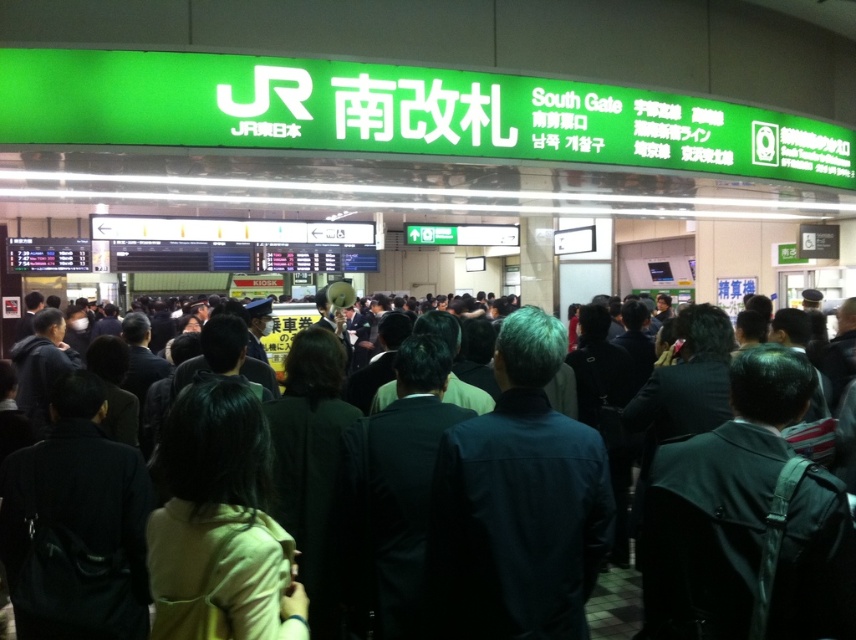
Is dark blue jacket at center thinner than dark blue suit at center?

No, dark blue jacket at center is not thinner than dark blue suit at center.

Which is in front, point (459, 456) or point (111, 396)?

Positioned in front is point (459, 456).

Between point (504, 451) and point (710, 420), which one is positioned in front?

Point (504, 451) is in front.

Locate an element on the screen. The image size is (856, 640). dark blue jacket at center is located at coordinates (516, 504).